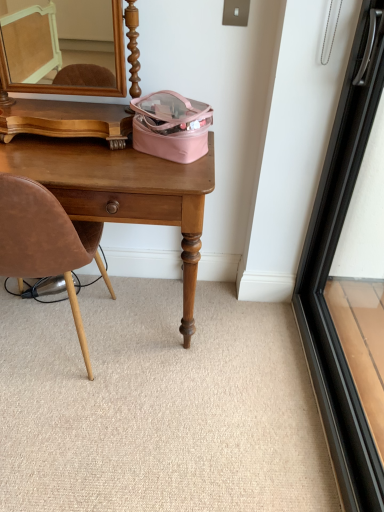
Question: Can you confirm if beige carpet at lower center is positioned to the left of black glass screen door at right?

Choices:
 (A) no
 (B) yes

Answer: (B)

Question: Is the depth of beige carpet at lower center greater than that of black glass screen door at right?

Choices:
 (A) yes
 (B) no

Answer: (A)

Question: From the image's perspective, is beige carpet at lower center located beneath black glass screen door at right?

Choices:
 (A) yes
 (B) no

Answer: (A)

Question: Is beige carpet at lower center aimed at black glass screen door at right?

Choices:
 (A) no
 (B) yes

Answer: (A)

Question: From the image's perspective, is beige carpet at lower center located above black glass screen door at right?

Choices:
 (A) yes
 (B) no

Answer: (B)

Question: Based on their positions, is black glass screen door at right located to the left or right of beige carpet at lower center?

Choices:
 (A) left
 (B) right

Answer: (B)

Question: Considering their positions, is black glass screen door at right located in front of or behind beige carpet at lower center?

Choices:
 (A) behind
 (B) front

Answer: (B)

Question: Considering the positions of black glass screen door at right and beige carpet at lower center in the image, is black glass screen door at right wider or thinner than beige carpet at lower center?

Choices:
 (A) thin
 (B) wide

Answer: (A)

Question: From the image's perspective, is black glass screen door at right positioned above or below beige carpet at lower center?

Choices:
 (A) below
 (B) above

Answer: (B)

Question: Is black glass screen door at right taller or shorter than brown leather chair at left?

Choices:
 (A) short
 (B) tall

Answer: (B)

Question: Is black glass screen door at right bigger or smaller than brown leather chair at left?

Choices:
 (A) small
 (B) big

Answer: (A)

Question: Considering the positions of point [364, 48] and point [29, 268], is point [364, 48] closer or farther from the camera than point [29, 268]?

Choices:
 (A) closer
 (B) farther

Answer: (B)

Question: From a real-world perspective, is black glass screen door at right above or below brown leather chair at left?

Choices:
 (A) below
 (B) above

Answer: (B)

Question: Is beige carpet at lower center inside the boundaries of wooden desk at center, or outside?

Choices:
 (A) outside
 (B) inside

Answer: (A)

Question: From a real-world perspective, is beige carpet at lower center above or below wooden desk at center?

Choices:
 (A) below
 (B) above

Answer: (A)